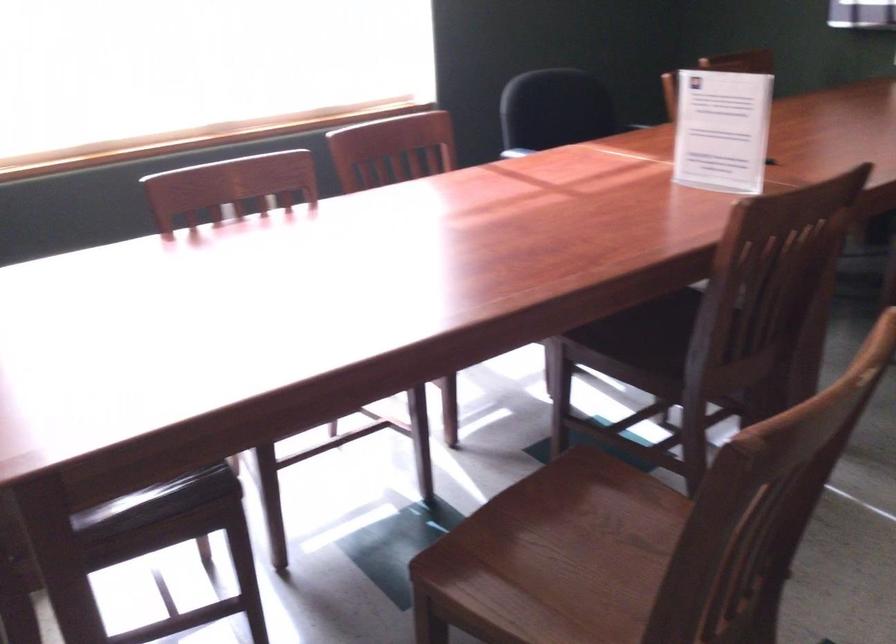
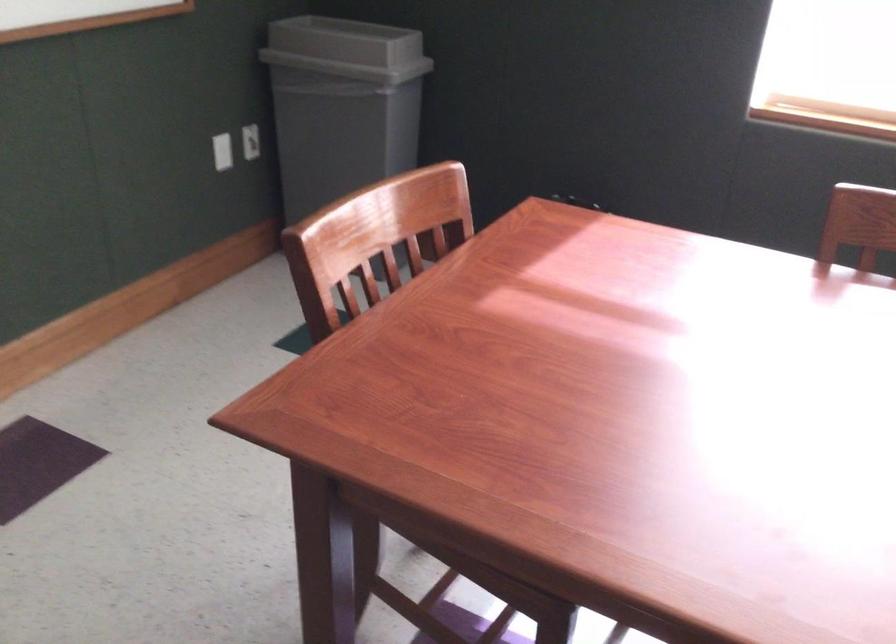
The images are taken continuously from a first-person perspective. In which direction is your viewpoint rotating?

The camera's rotation is toward left-down.